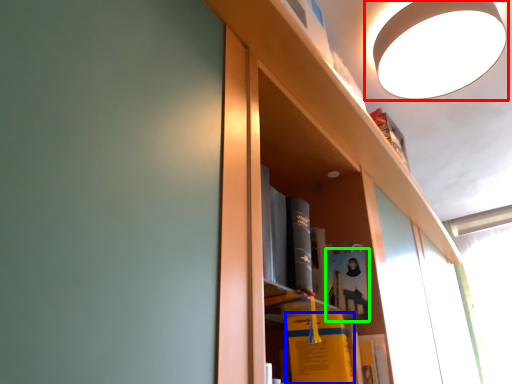
Question: Which object is positioned closest to lamp (highlighted by a red box)? Select from book (highlighted by a blue box) and book (highlighted by a green box).

Choices:
 (A) book
 (B) book

Answer: (B)